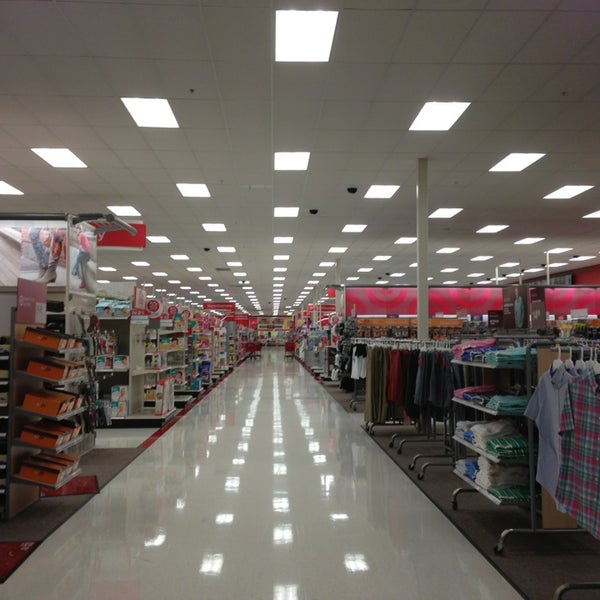
Find the location of a particular element. shiny white tile floor is located at coordinates (281, 489).